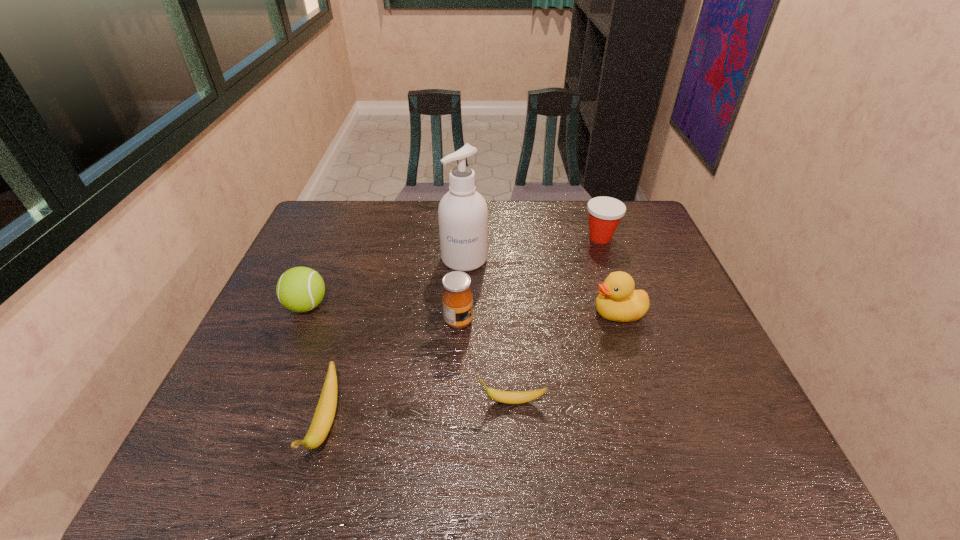
At what (x,y) coordinates should I click in order to perform the action: click on the second object from left to right. Please return your answer as a coordinate pair (x, y). Looking at the image, I should click on (324, 414).

Locate an element on the screen. the taller banana is located at coordinates tap(324, 414).

The image size is (960, 540). What are the coordinates of `the shorter banana` in the screenshot? It's located at (508, 397).

This screenshot has width=960, height=540. What are the coordinates of `the shortest object` in the screenshot? It's located at (508, 397).

You are a GUI agent. You are given a task and a screenshot of the screen. Output one action in this format:
    pyautogui.click(x=<x>, y=<y>)
    Task: Click on the Dixie cup
    
    Given the screenshot: What is the action you would take?
    coord(605,213)

You are a GUI agent. You are given a task and a screenshot of the screen. Output one action in this format:
    pyautogui.click(x=<x>, y=<y>)
    Task: Click on the honey
    This screenshot has height=540, width=960.
    Given the screenshot: What is the action you would take?
    pyautogui.click(x=457, y=299)

I want to click on tennis ball, so click(x=299, y=289).

Locate an element on the screen. cleansing agent is located at coordinates (462, 213).

At what (x,y) coordinates should I click in order to perform the action: click on duck. Please return your answer as a coordinate pair (x, y). This screenshot has height=540, width=960. Looking at the image, I should click on (617, 301).

Identify the location of free space located at the stem of the shortest object. 415,401.